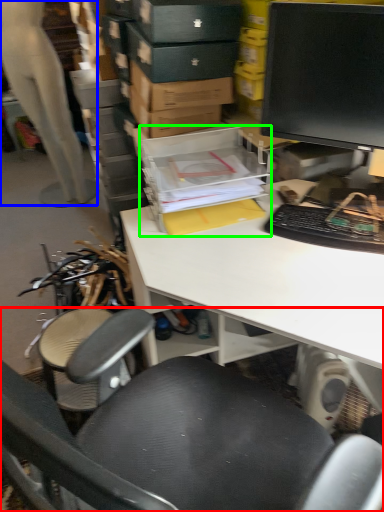
Question: Based on their relative distances, which object is nearer to chair (highlighted by a red box)? Choose from person (highlighted by a blue box) and storage box (highlighted by a green box).

Choices:
 (A) person
 (B) storage box

Answer: (B)